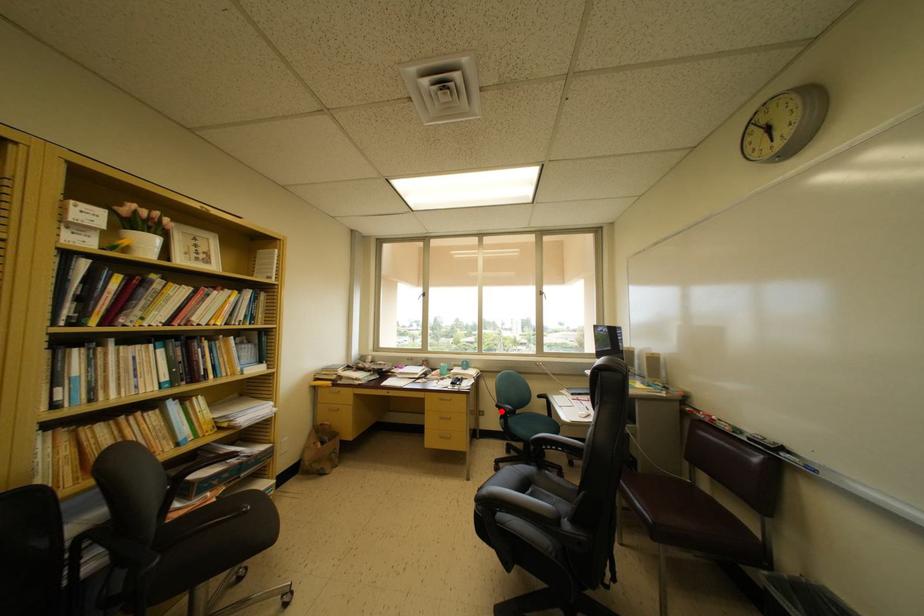
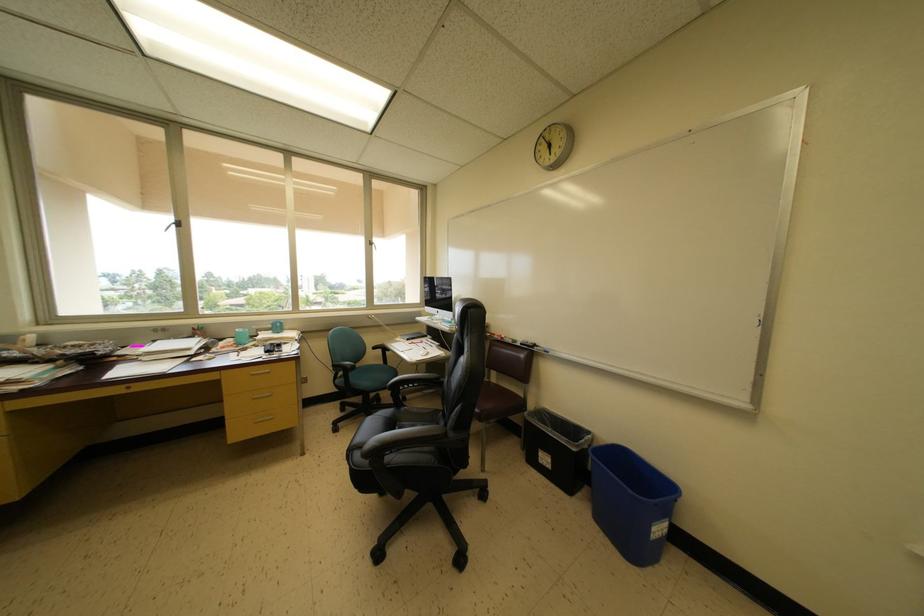
Find the pixel in the second image that matches the highlighted location in the first image.

(338, 371)